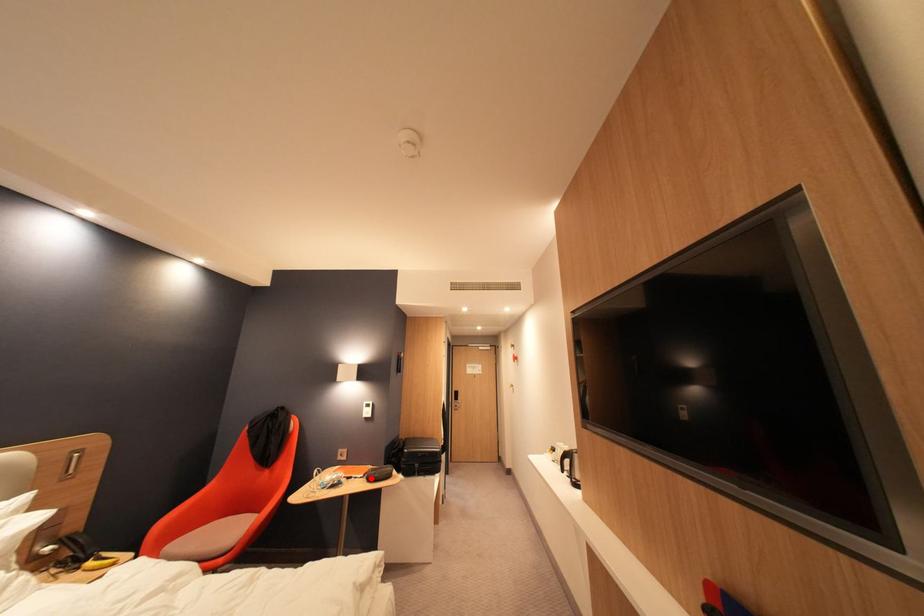
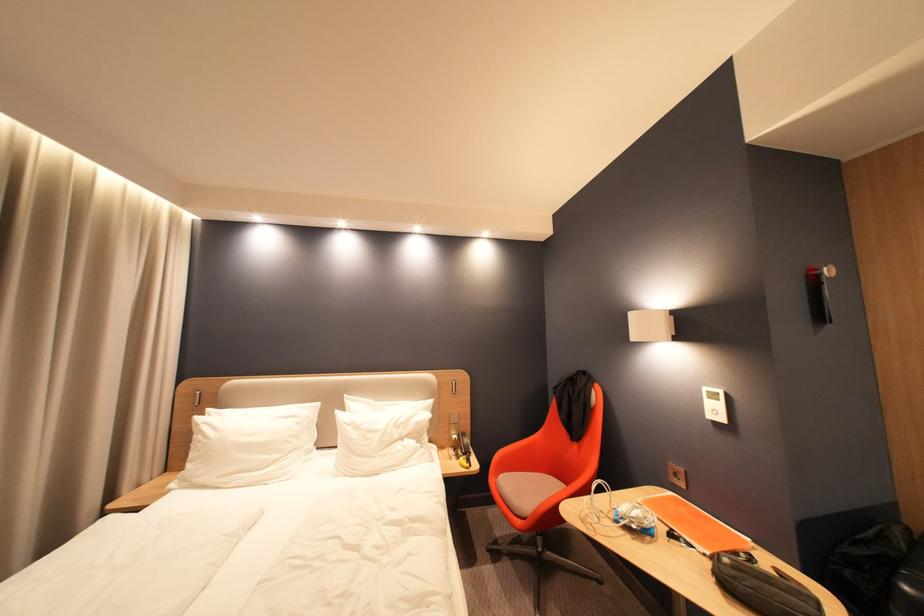
Question: I am providing you with two images of the same scene from different viewpoints. Given a red point in image1, look at the same physical point in image2. Is it:

Choices:
 (A) Closer to the viewpoint
 (B) Farther from the viewpoint

Answer: (A)